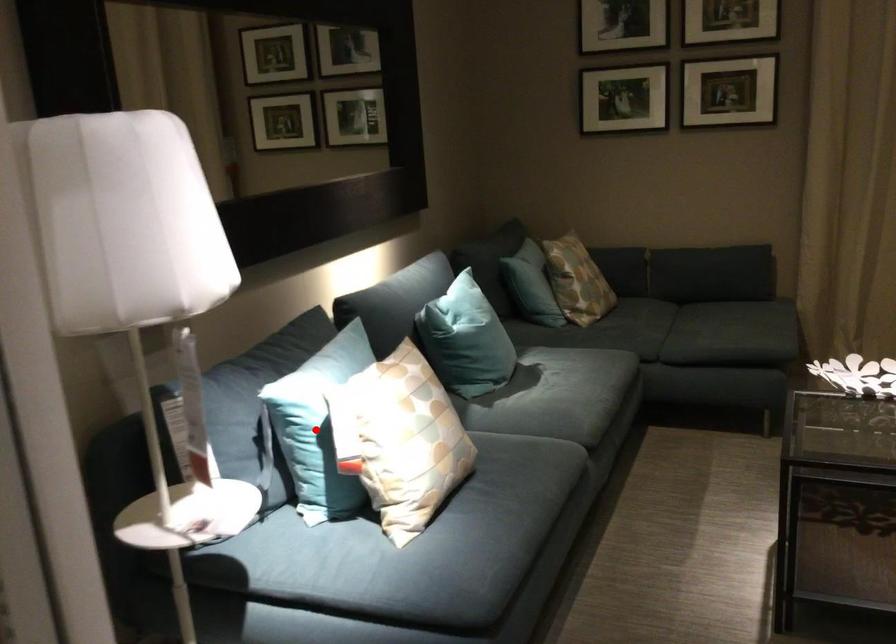
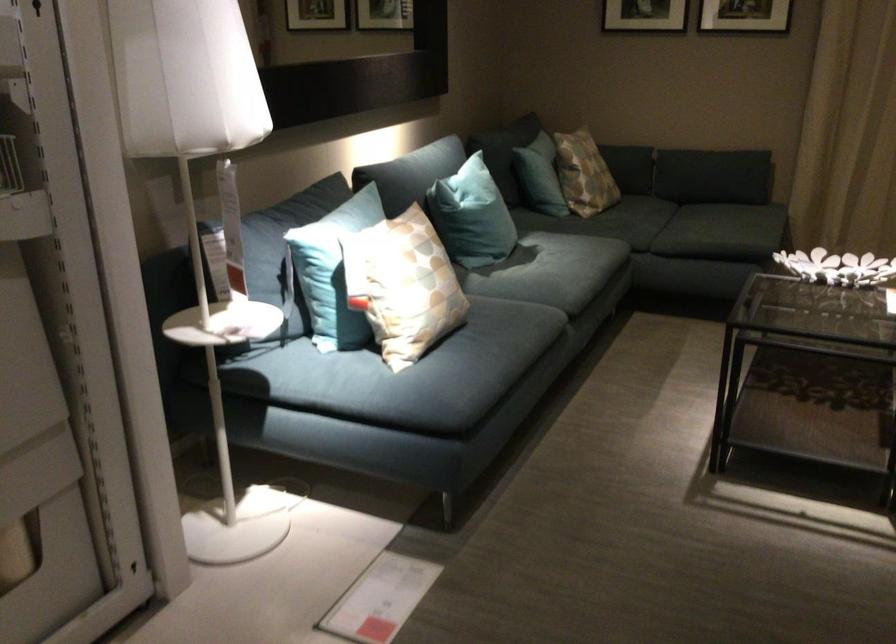
Question: A red point is marked in image1. In image2, is the corresponding 3D point closer to the camera or farther? Reply with the corresponding letter.

Choices:
 (A) The corresponding 3D point is closer.
 (B) The corresponding 3D point is farther.

Answer: (B)